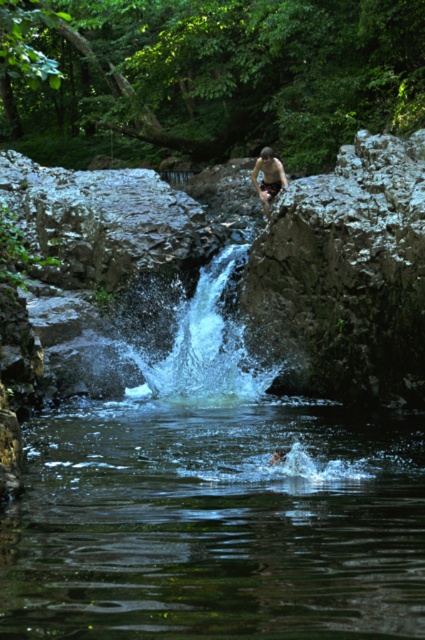
Question: Observing the image, what is the correct spatial positioning of clear water at center in reference to smooth skin person at upper center?

Choices:
 (A) right
 (B) left

Answer: (B)

Question: Which point is closer to the camera?

Choices:
 (A) (260, 188)
 (B) (64, 604)

Answer: (B)

Question: Does clear water at center appear over smooth skin person at upper center?

Choices:
 (A) no
 (B) yes

Answer: (A)

Question: Which point is closer to the camera?

Choices:
 (A) click(x=258, y=186)
 (B) click(x=368, y=566)

Answer: (B)

Question: Does clear water at center have a smaller size compared to smooth skin person at upper center?

Choices:
 (A) no
 (B) yes

Answer: (A)